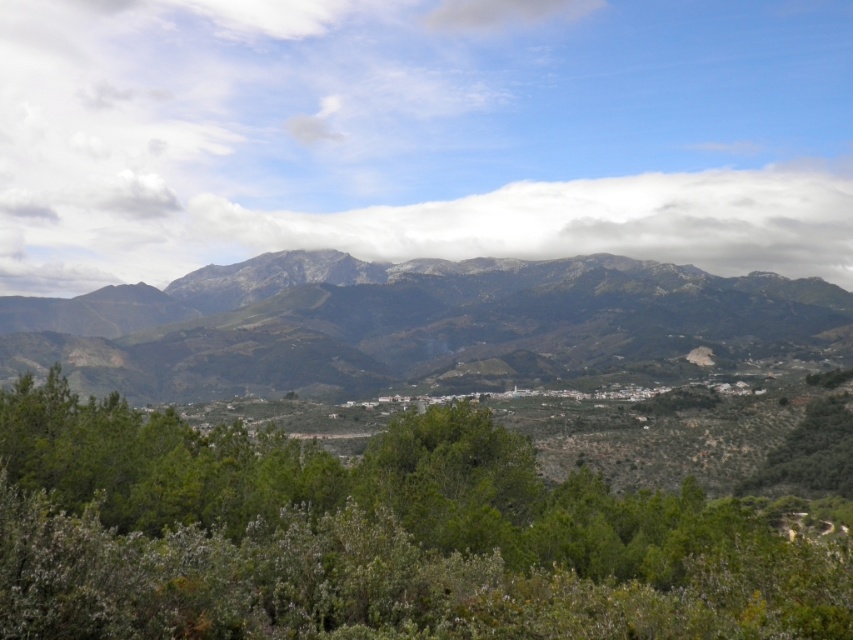
Question: Observing the image, what is the correct spatial positioning of green leafy tree at center in reference to white fluffy cloud at center?

Choices:
 (A) above
 (B) below

Answer: (B)

Question: Which object is the closest to the rocky gray mountain range at center?

Choices:
 (A) white fluffy cloud at center
 (B) green leafy tree at center

Answer: (A)

Question: Which point is closer to the camera?

Choices:
 (A) green leafy tree at center
 (B) white fluffy cloud at center
 (C) rocky gray mountain range at center

Answer: (A)

Question: Is rocky gray mountain range at center below white fluffy cloud at center?

Choices:
 (A) no
 (B) yes

Answer: (B)

Question: Which point is farther to the camera?

Choices:
 (A) green leafy tree at center
 (B) white fluffy cloud at center
 (C) rocky gray mountain range at center

Answer: (B)

Question: Observing the image, what is the correct spatial positioning of rocky gray mountain range at center in reference to white fluffy cloud at center?

Choices:
 (A) right
 (B) left

Answer: (B)